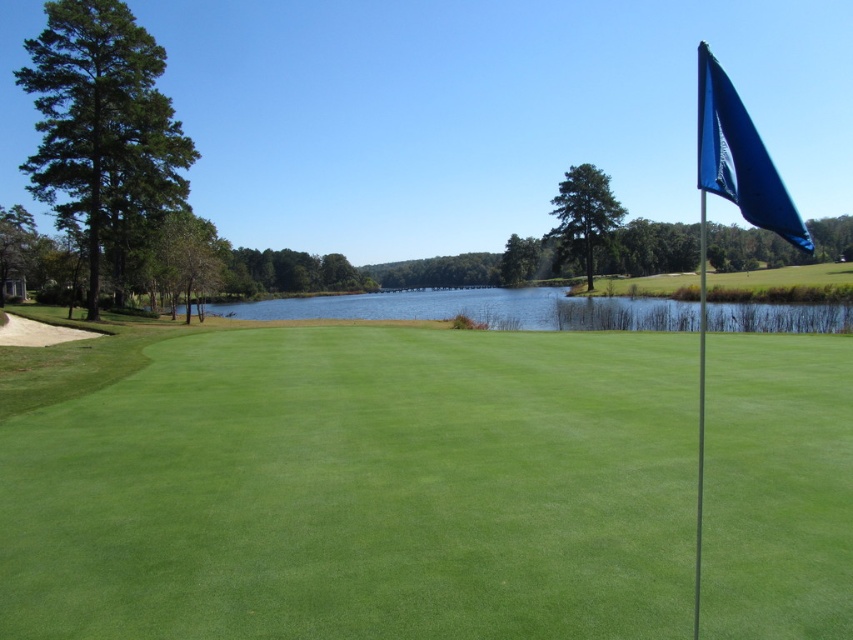
Question: Can you confirm if green grass at center is wider than clear blue water at center?

Choices:
 (A) no
 (B) yes

Answer: (A)

Question: In this image, where is clear blue water at center located relative to blue fabric flag at upper right?

Choices:
 (A) left
 (B) right

Answer: (A)

Question: Among these points, which one is farthest from the camera?

Choices:
 (A) (9, 538)
 (B) (492, 316)

Answer: (B)

Question: Which object appears farthest from the camera in this image?

Choices:
 (A) blue fabric flag at upper right
 (B) clear blue water at center

Answer: (B)

Question: Which object is positioned farthest from the green grass at center?

Choices:
 (A) blue fabric flag at upper right
 (B) clear blue water at center

Answer: (B)

Question: Does green grass at center appear over blue fabric flag at upper right?

Choices:
 (A) no
 (B) yes

Answer: (A)